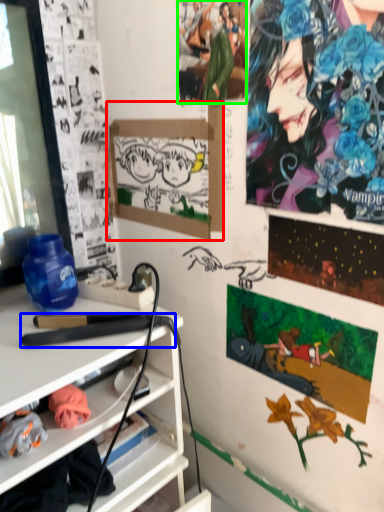
Question: Which is nearer to the bulletin board (highlighted by a red box)? equipment (highlighted by a blue box) or person (highlighted by a green box).

Choices:
 (A) equipment
 (B) person

Answer: (B)